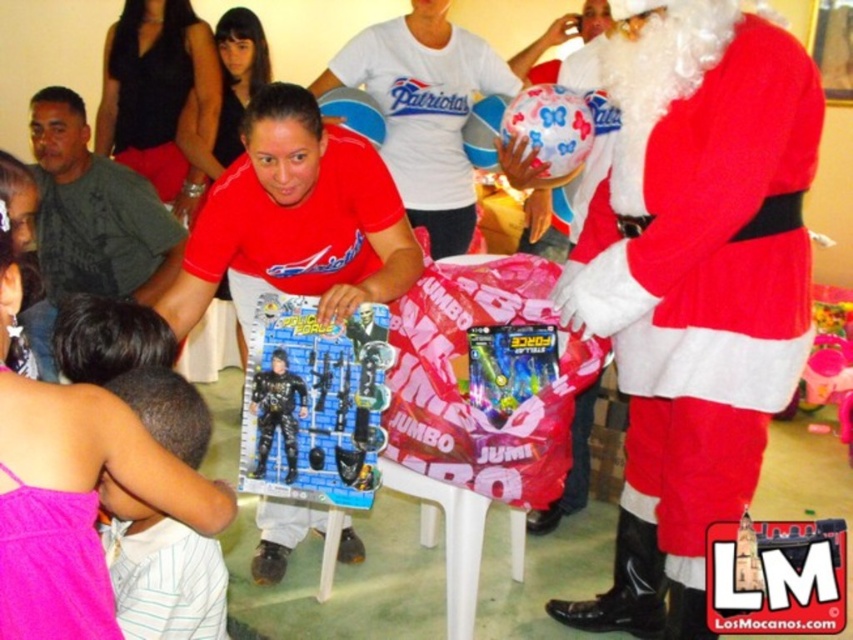
You are a guest at this festive event and you see two action figures on the table. The first is a matte black action figure at center and the second is a black matte action figure at center. Which one is on the right side?

The matte black action figure at center is positioned on the right side of the black matte action figure at center.

You are standing at a distance of 8 feet from the table in the festive scene. Can you reach the point marked at coordinates point (241, 285) without moving closer? Please explain your reasoning.

The point marked at coordinates point (241, 285) is 7.95 feet away from the viewer. Since you are standing 8 feet away from the table, you can just barely reach it without moving closer, as the distance is almost the same.